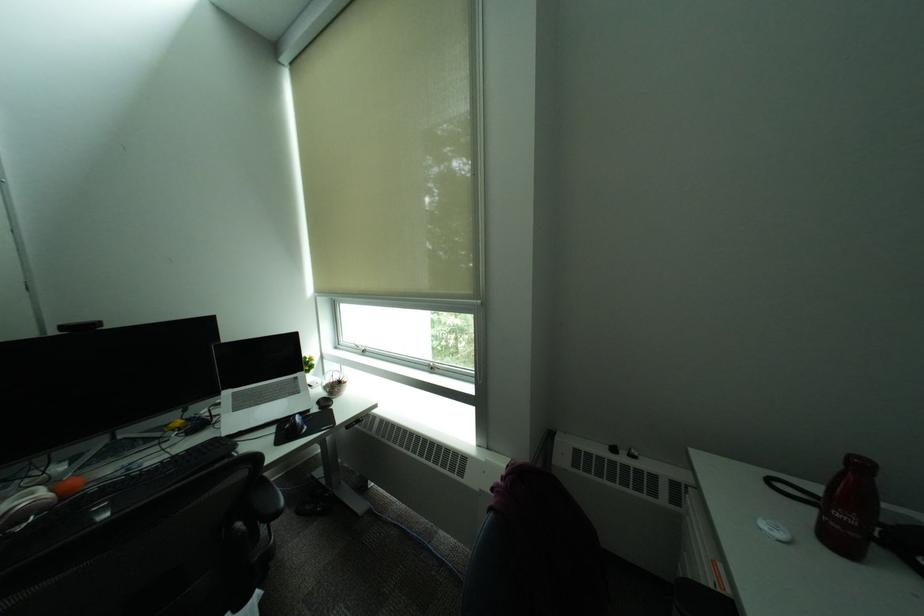
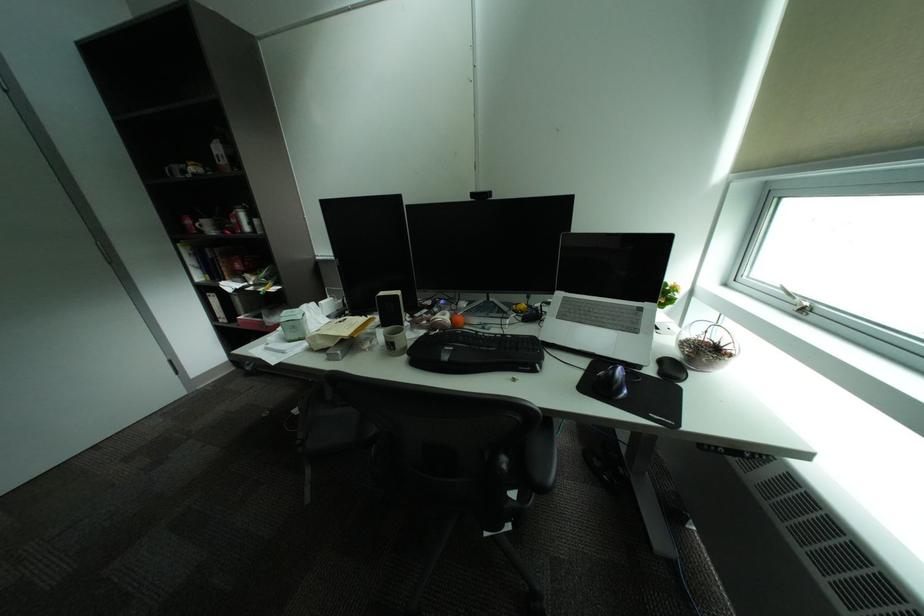
Find the pixel in the second image that matches pixel 310 429 in the first image.

(626, 389)